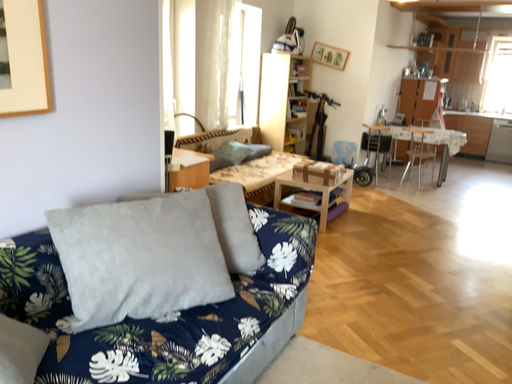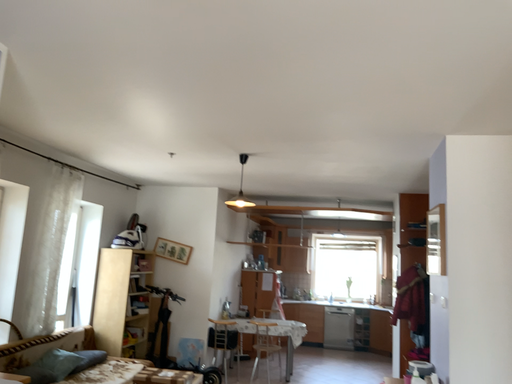
Question: Which way did the camera rotate in the video?

Choices:
 (A) rotated left
 (B) rotated right

Answer: (B)